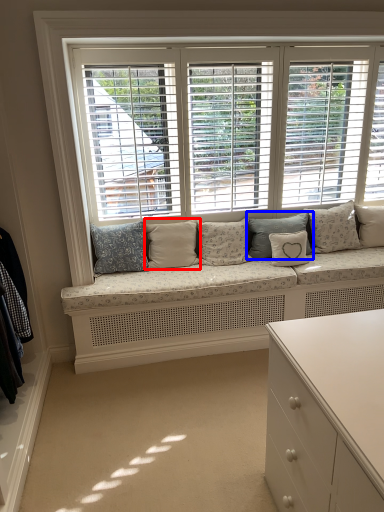
Question: Which object appears closest to the camera in this image, pillow (highlighted by a red box) or pillow (highlighted by a blue box)?

Choices:
 (A) pillow
 (B) pillow

Answer: (A)